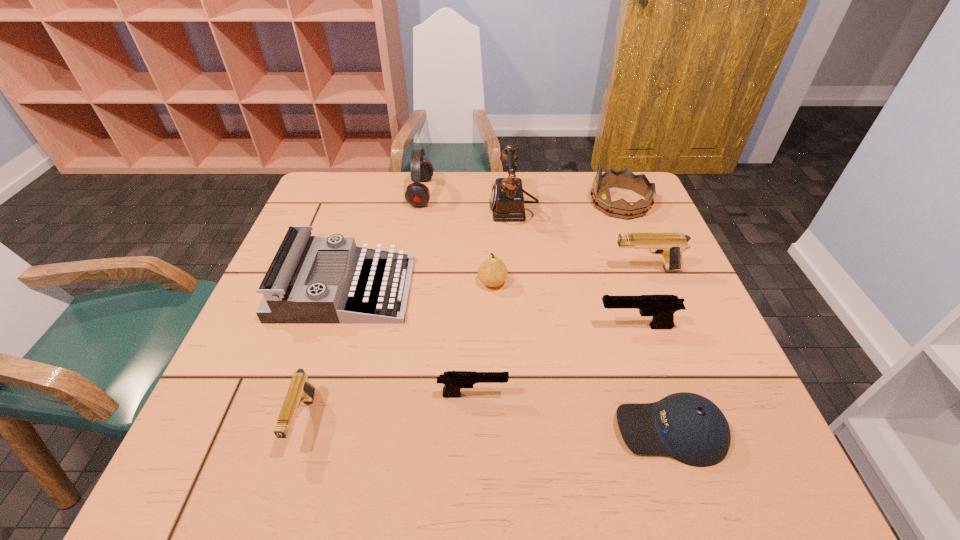
Locate an element on the screen. This screenshot has height=540, width=960. free space between the pear and the red tiara is located at coordinates (556, 242).

In order to click on vacant area that lies between the smaller black pistol and the right black pistol in this screenshot , I will do `click(554, 361)`.

The height and width of the screenshot is (540, 960). Find the location of `free point between the telephone and the pear`. free point between the telephone and the pear is located at coordinates pyautogui.click(x=502, y=246).

Locate an element on the screen. Image resolution: width=960 pixels, height=540 pixels. empty space that is in between the earphone and the blue baseball cap is located at coordinates (545, 312).

The image size is (960, 540). I want to click on free area in between the earphone and the typewriter, so click(382, 241).

Find the location of a particular element. empty space that is in between the typewriter and the pear is located at coordinates (418, 286).

Find the location of a particular element. This screenshot has width=960, height=540. object that is the third nearest to the gray telephone is located at coordinates (417, 194).

Locate an element on the screen. object that is the fifth closest to the red tiara is located at coordinates (417, 194).

Identify which pistol is located as the second nearest to the gray telephone. Please provide its 2D coordinates. Your answer should be formatted as a tuple, i.e. [(x, y)], where the tuple contains the x and y coordinates of a point satisfying the conditions above.

[(662, 307)]

Identify which pistol is the second closest to the left tan pistol. Please provide its 2D coordinates. Your answer should be formatted as a tuple, i.e. [(x, y)], where the tuple contains the x and y coordinates of a point satisfying the conditions above.

[(662, 307)]